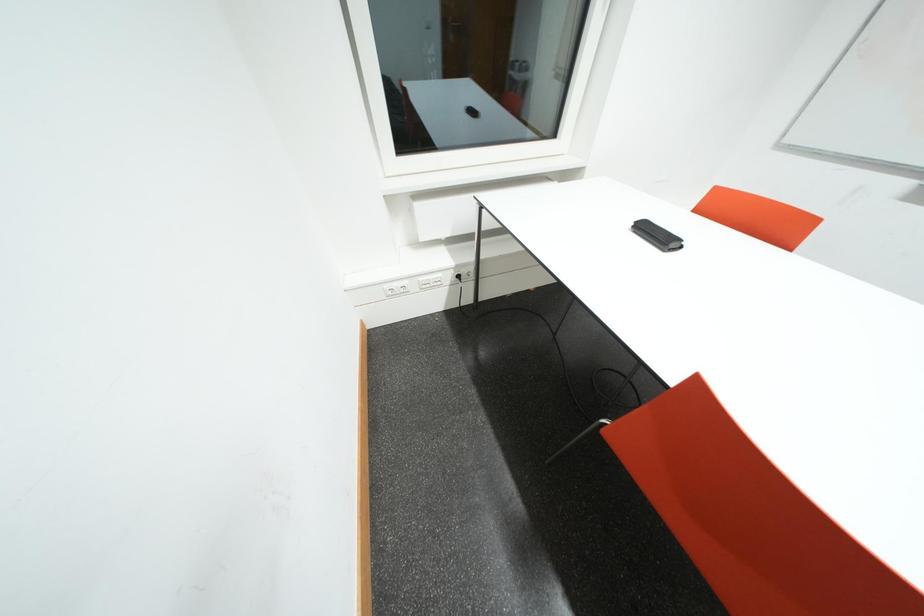
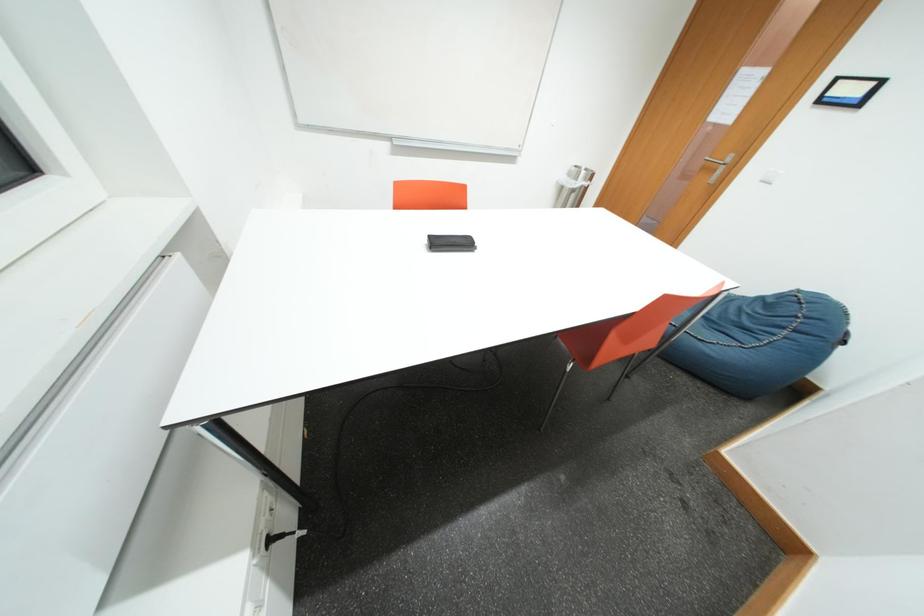
Based on the continuous images, in which direction is the camera rotating?

The camera rotated toward right-down.